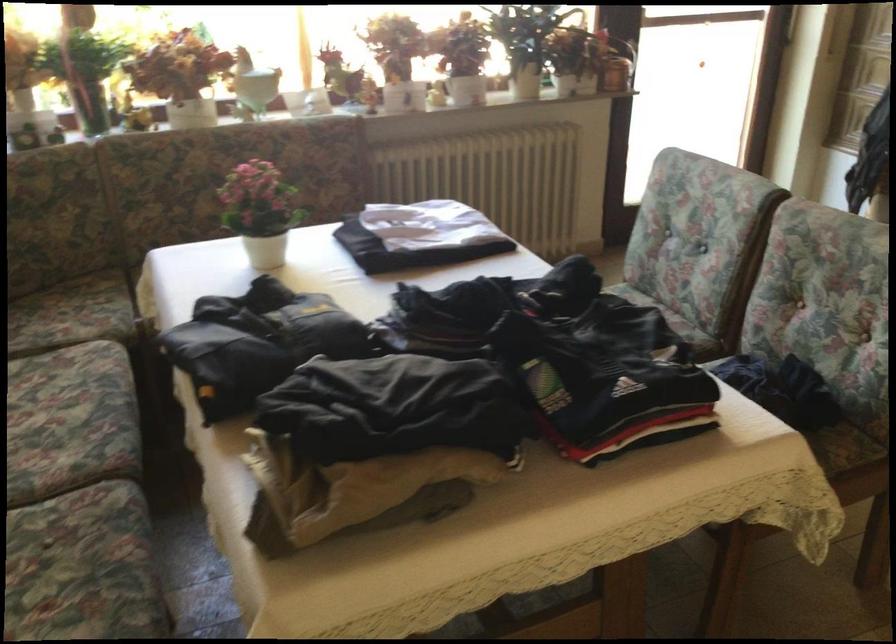
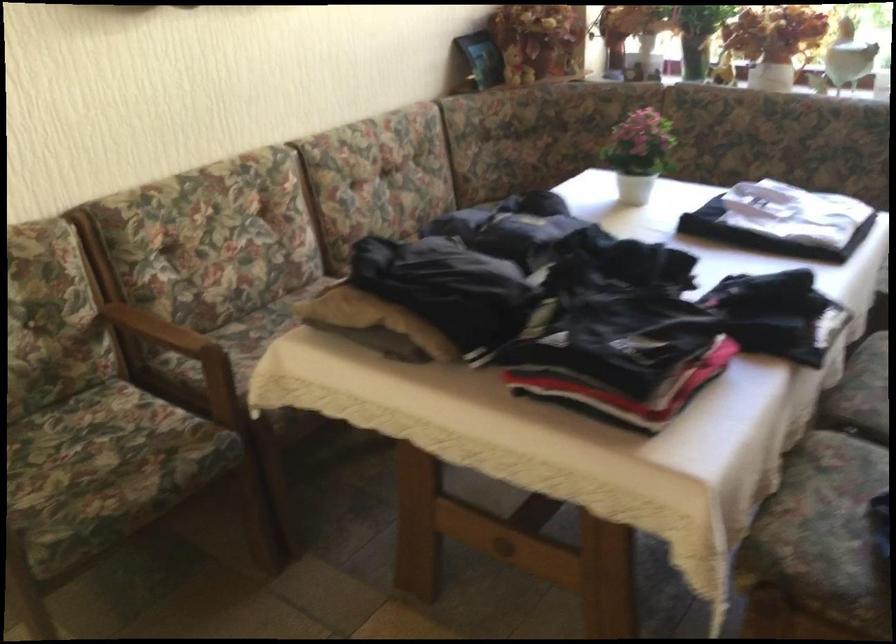
Locate, in the second image, the point that corresponds to (x=373, y=489) in the first image.

(351, 307)